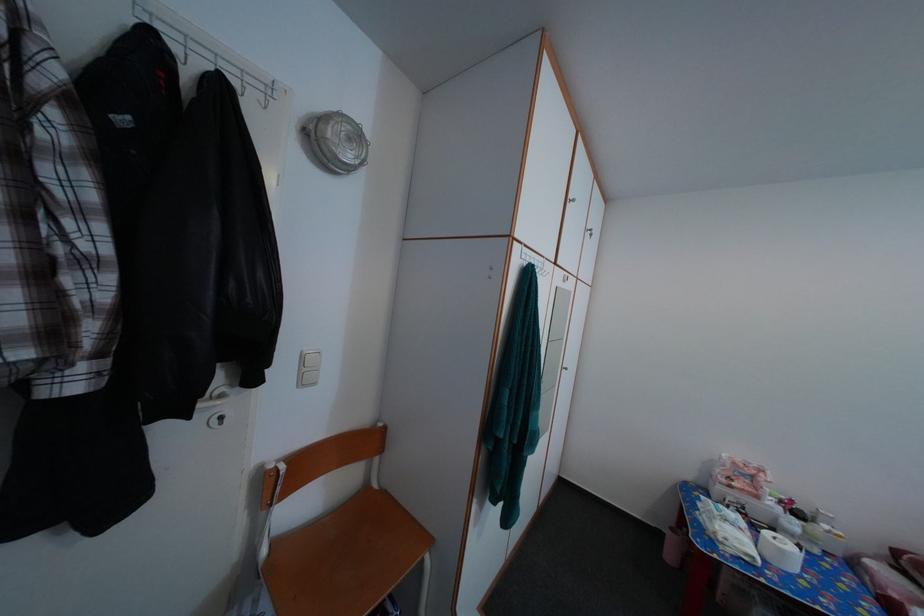
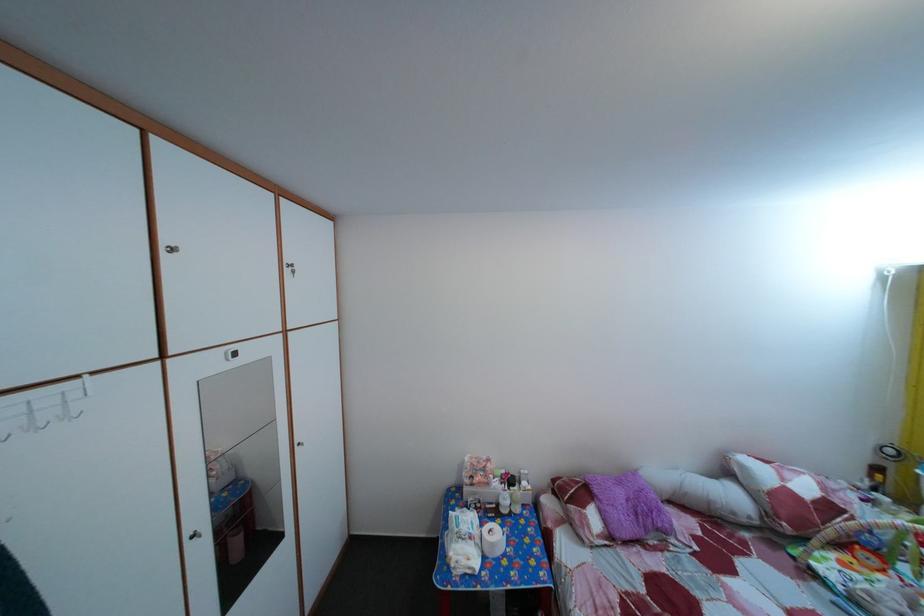
Where in the second image is the point corresponding to pixel 792 560 from the first image?

(502, 553)